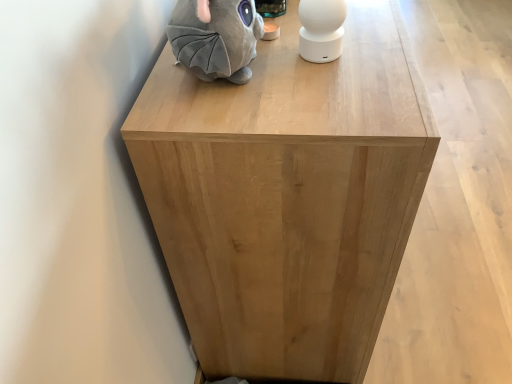
Find the location of a particular element. Image resolution: width=512 pixels, height=384 pixels. vacant area located to the right-hand side of white matte speaker at upper center, the second toy positioned from the left is located at coordinates (385, 46).